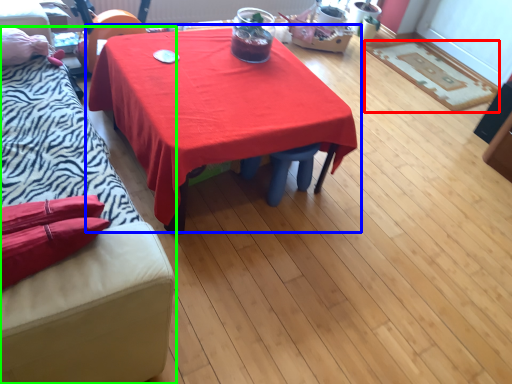
Question: Which object is the farthest from mat (highlighted by a red box)? Choose among these: table (highlighted by a blue box) or studio couch (highlighted by a green box).

Choices:
 (A) table
 (B) studio couch

Answer: (B)